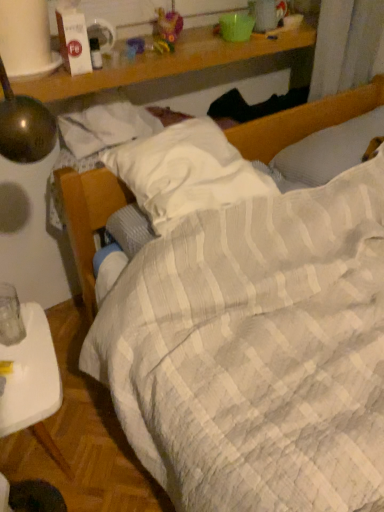
Locate an element on the screen. white textured pillow at upper right, which ranks as the 1th pillow in right-to-left order is located at coordinates (326, 152).

Based on the photo, what's the angular difference between white quilted pillow at center, which is the first pillow from left to right, and white textured pillow at upper right, marked as the 2th pillow in a left-to-right arrangement,'s facing directions?

There is a 2.31-degree angle between the facing directions of white quilted pillow at center, which is the first pillow from left to right, and white textured pillow at upper right, marked as the 2th pillow in a left-to-right arrangement.

Measure the distance from white quilted pillow at center, the second pillow when ordered from right to left, to white textured pillow at upper right, which ranks as the 1th pillow in right-to-left order.

13.25 inches.

Image resolution: width=384 pixels, height=512 pixels. Find the location of `pillow located above the white quilted pillow at center, which is the first pillow from left to right (from a real-world perspective)`. pillow located above the white quilted pillow at center, which is the first pillow from left to right (from a real-world perspective) is located at coordinates (326, 152).

Is white quilted pillow at center, which is the first pillow from left to right, not inside white textured pillow at upper right, which ranks as the 1th pillow in right-to-left order?

Yes, white quilted pillow at center, which is the first pillow from left to right, is located beyond the bounds of white textured pillow at upper right, which ranks as the 1th pillow in right-to-left order.

Is white textured pillow at upper right, which ranks as the 1th pillow in right-to-left order, inside or outside of white plastic tray at lower left?

white textured pillow at upper right, which ranks as the 1th pillow in right-to-left order, is spatially situated outside white plastic tray at lower left.

Is white textured pillow at upper right, which ranks as the 1th pillow in right-to-left order, directly adjacent to white plastic tray at lower left?

No.

Based on the photo, from a real-world perspective, relative to white plastic tray at lower left, is white textured pillow at upper right, which ranks as the 1th pillow in right-to-left order, vertically above or below?

In terms of real-world spatial position, white textured pillow at upper right, which ranks as the 1th pillow in right-to-left order, is above white plastic tray at lower left.

Is white textured pillow at upper right, marked as the 2th pillow in a left-to-right arrangement, bigger than white plastic tray at lower left?

Incorrect, white textured pillow at upper right, marked as the 2th pillow in a left-to-right arrangement, is not larger than white plastic tray at lower left.

What's the angular difference between white plastic tray at lower left and white textured pillow at upper right, marked as the 2th pillow in a left-to-right arrangement,'s facing directions?

There is a 81.2-degree angle between the facing directions of white plastic tray at lower left and white textured pillow at upper right, marked as the 2th pillow in a left-to-right arrangement.

Is white plastic tray at lower left not inside white textured pillow at upper right, which ranks as the 1th pillow in right-to-left order?

Yes, white plastic tray at lower left is outside of white textured pillow at upper right, which ranks as the 1th pillow in right-to-left order.

Relative to white textured pillow at upper right, which ranks as the 1th pillow in right-to-left order, is white plastic tray at lower left in front or behind?

Clearly, white plastic tray at lower left is in front of white textured pillow at upper right, which ranks as the 1th pillow in right-to-left order.

Could you measure the distance between white plastic tray at lower left and white textured pillow at upper right, marked as the 2th pillow in a left-to-right arrangement?

white plastic tray at lower left and white textured pillow at upper right, marked as the 2th pillow in a left-to-right arrangement, are 35.69 inches apart.

Find the location of `pillow in front of the white textured pillow at upper right, marked as the 2th pillow in a left-to-right arrangement`. pillow in front of the white textured pillow at upper right, marked as the 2th pillow in a left-to-right arrangement is located at coordinates (185, 172).

Does white textured pillow at upper right, which ranks as the 1th pillow in right-to-left order, have a lesser width compared to white quilted pillow at center, the second pillow when ordered from right to left?

Correct, the width of white textured pillow at upper right, which ranks as the 1th pillow in right-to-left order, is less than that of white quilted pillow at center, the second pillow when ordered from right to left.

Is point (377, 130) more distant than point (220, 140)?

Yes, point (377, 130) is farther from viewer.

How different are the orientations of white textured pillow at upper right, which ranks as the 1th pillow in right-to-left order, and white quilted pillow at center, which is the first pillow from left to right, in degrees?

white textured pillow at upper right, which ranks as the 1th pillow in right-to-left order, and white quilted pillow at center, which is the first pillow from left to right, are facing 2.31 degrees away from each other.

Can you confirm if white quilted pillow at center, which is the first pillow from left to right, is positioned to the left of white plastic tray at lower left?

No.

How many degrees apart are the facing directions of white quilted pillow at center, which is the first pillow from left to right, and white plastic tray at lower left?

83.5 degrees separate the facing orientations of white quilted pillow at center, which is the first pillow from left to right, and white plastic tray at lower left.

From the image's perspective, count 1st pillows upward from the white plastic tray at lower left and point to it. Please provide its 2D coordinates.

[(185, 172)]

Is white quilted pillow at center, which is the first pillow from left to right, shorter than white plastic tray at lower left?

Correct, white quilted pillow at center, which is the first pillow from left to right, is not as tall as white plastic tray at lower left.

From a real-world perspective, who is located higher, white plastic tray at lower left or white quilted pillow at center, which is the first pillow from left to right?

From a 3D spatial view, white quilted pillow at center, which is the first pillow from left to right, is above.

Would you say white plastic tray at lower left is outside white quilted pillow at center, which is the first pillow from left to right?

Yes, white plastic tray at lower left is not within white quilted pillow at center, which is the first pillow from left to right.

Which object is positioned more to the left, white plastic tray at lower left or white quilted pillow at center, the second pillow when ordered from right to left?

Positioned to the left is white plastic tray at lower left.

From the image's perspective, is white plastic tray at lower left on white quilted pillow at center, the second pillow when ordered from right to left?

Incorrect, from the image's perspective, white plastic tray at lower left is lower than white quilted pillow at center, the second pillow when ordered from right to left.

You are a GUI agent. You are given a task and a screenshot of the screen. Output one action in this format:
    pyautogui.click(x=<x>, y=<y>)
    Task: Click on the pillow that appears behind the white quilted pillow at center, the second pillow when ordered from right to left
    Image resolution: width=384 pixels, height=512 pixels.
    Given the screenshot: What is the action you would take?
    pyautogui.click(x=326, y=152)

The height and width of the screenshot is (512, 384). What are the coordinates of `the 2nd pillow to the right of the white plastic tray at lower left, counting from the anchor's position` in the screenshot? It's located at (326, 152).

Based on their spatial positions, is white quilted pillow at center, the second pillow when ordered from right to left, or white plastic tray at lower left closer to white textured pillow at upper right, which ranks as the 1th pillow in right-to-left order?

white quilted pillow at center, the second pillow when ordered from right to left, is closer to white textured pillow at upper right, which ranks as the 1th pillow in right-to-left order.

Looking at the image, which one is located further to white quilted pillow at center, which is the first pillow from left to right, white textured pillow at upper right, marked as the 2th pillow in a left-to-right arrangement, or white plastic tray at lower left?

The object further to white quilted pillow at center, which is the first pillow from left to right, is white plastic tray at lower left.

Estimate the real-world distances between objects in this image. Which object is further from white quilted pillow at center, the second pillow when ordered from right to left, white plastic tray at lower left or white textured pillow at upper right, marked as the 2th pillow in a left-to-right arrangement?

Based on the image, white plastic tray at lower left appears to be further to white quilted pillow at center, the second pillow when ordered from right to left.

Estimate the real-world distances between objects in this image. Which object is closer to white plastic tray at lower left, white textured pillow at upper right, which ranks as the 1th pillow in right-to-left order, or white quilted pillow at center, the second pillow when ordered from right to left?

The object closer to white plastic tray at lower left is white quilted pillow at center, the second pillow when ordered from right to left.

When comparing their distances from white textured pillow at upper right, which ranks as the 1th pillow in right-to-left order, does white plastic tray at lower left or white quilted pillow at center, the second pillow when ordered from right to left, seem further?

white plastic tray at lower left is positioned further to the anchor white textured pillow at upper right, which ranks as the 1th pillow in right-to-left order.

When comparing their distances from white plastic tray at lower left, does white quilted pillow at center, the second pillow when ordered from right to left, or white textured pillow at upper right, which ranks as the 1th pillow in right-to-left order, seem closer?

white quilted pillow at center, the second pillow when ordered from right to left, lies closer to white plastic tray at lower left than the other object.

At what (x,y) coordinates should I click in order to perform the action: click on pillow situated between white plastic tray at lower left and white textured pillow at upper right, which ranks as the 1th pillow in right-to-left order, from left to right. Please return your answer as a coordinate pair (x, y). The width and height of the screenshot is (384, 512). Looking at the image, I should click on (185, 172).